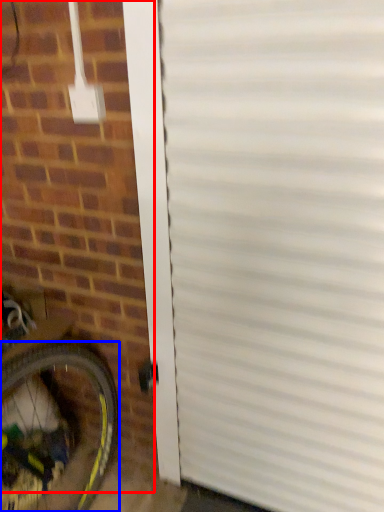
Question: Which point is closer to the camera, brickwork (highlighted by a red box) or bicycle wheel (highlighted by a blue box)?

Choices:
 (A) brickwork
 (B) bicycle wheel

Answer: (A)